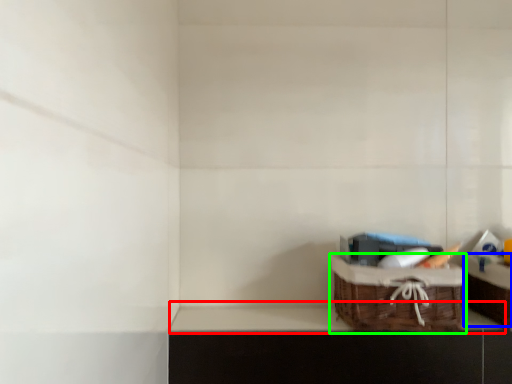
Question: Which object is the closest to the window sill (highlighted by a red box)? Choose among these: cabinetry (highlighted by a blue box) or picnic basket (highlighted by a green box).

Choices:
 (A) cabinetry
 (B) picnic basket

Answer: (B)